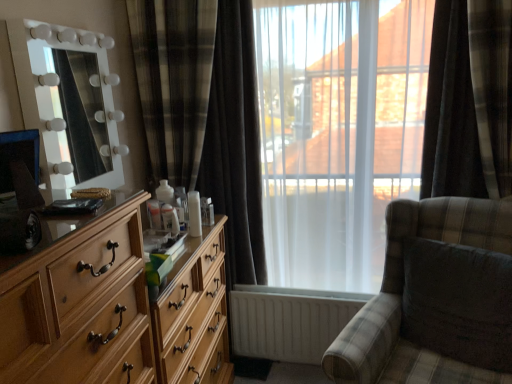
What do you see at coordinates (469, 101) in the screenshot? The height and width of the screenshot is (384, 512). I see `dark plaid curtain at right, the first curtain viewed from the right` at bounding box center [469, 101].

At what (x,y) coordinates should I click in order to perform the action: click on plaid fabric rocking chair at center. Please return your answer as a coordinate pair (x, y). Looking at the image, I should click on pyautogui.click(x=436, y=299).

The width and height of the screenshot is (512, 384). Describe the element at coordinates (338, 133) in the screenshot. I see `white sheer curtains at center` at that location.

What do you see at coordinates (205, 113) in the screenshot? The height and width of the screenshot is (384, 512). I see `plaid fabric curtain at center, positioned as the first curtain in left-to-right order` at bounding box center [205, 113].

The image size is (512, 384). Describe the element at coordinates (115, 310) in the screenshot. I see `light wood dresser at left` at that location.

Find the location of `plaid fabric swivel chair at right`. plaid fabric swivel chair at right is located at coordinates (458, 302).

Is light wood dresser at left oriented towards plaid fabric curtain at center, which is counted as the second curtain, starting from the right?

No, light wood dresser at left does not turn towards plaid fabric curtain at center, which is counted as the second curtain, starting from the right.

You are a GUI agent. You are given a task and a screenshot of the screen. Output one action in this format:
    pyautogui.click(x=<x>, y=<y>)
    Task: Click on the chest of drawers on the left of the plaid fabric curtain at center, which is counted as the second curtain, starting from the right
    This screenshot has height=384, width=512.
    Given the screenshot: What is the action you would take?
    pyautogui.click(x=115, y=310)

Is light wood dresser at left surrounding plaid fabric curtain at center, which is counted as the second curtain, starting from the right?

No, plaid fabric curtain at center, which is counted as the second curtain, starting from the right, is not inside light wood dresser at left.

Which is less distant, (430, 147) or (473, 323)?

Point (430, 147) is farther from the camera than point (473, 323).

Can plaid fabric rocking chair at center be found inside dark plaid curtain at right, which ranks as the 2th curtain in left-to-right order?

No, dark plaid curtain at right, which ranks as the 2th curtain in left-to-right order, does not contain plaid fabric rocking chair at center.

From the image's perspective, is dark plaid curtain at right, which ranks as the 2th curtain in left-to-right order, located above plaid fabric rocking chair at center?

Yes, from the image's perspective, dark plaid curtain at right, which ranks as the 2th curtain in left-to-right order, is on top of plaid fabric rocking chair at center.

Is dark plaid curtain at right, which ranks as the 2th curtain in left-to-right order, with plaid fabric rocking chair at center?

No.

Is light wood dresser at left in contact with dark plaid curtain at right, the first curtain viewed from the right?

No, light wood dresser at left is not with dark plaid curtain at right, the first curtain viewed from the right.

From a real-world perspective, does light wood dresser at left sit lower than dark plaid curtain at right, the first curtain viewed from the right?

Indeed, from a real-world perspective, light wood dresser at left is positioned beneath dark plaid curtain at right, the first curtain viewed from the right.

Where is `the 2nd curtain located above the light wood dresser at left (from a real-world perspective)`? The width and height of the screenshot is (512, 384). the 2nd curtain located above the light wood dresser at left (from a real-world perspective) is located at coordinates (469, 101).

Considering the sizes of objects light wood dresser at left and dark plaid curtain at right, which ranks as the 2th curtain in left-to-right order, in the image provided, who is smaller, light wood dresser at left or dark plaid curtain at right, which ranks as the 2th curtain in left-to-right order,?

With smaller size is dark plaid curtain at right, which ranks as the 2th curtain in left-to-right order.

Which object is positioned more to the right, plaid fabric swivel chair at right or white sheer curtains at center?

Positioned to the right is plaid fabric swivel chair at right.

Between point (496, 263) and point (326, 289), which one is positioned behind?

Point (326, 289)

From a real-world perspective, is plaid fabric swivel chair at right positioned above or below white sheer curtains at center?

plaid fabric swivel chair at right is below white sheer curtains at center.

From the image's perspective, is plaid fabric swivel chair at right positioned above or below white sheer curtains at center?

Based on their image positions, plaid fabric swivel chair at right is located beneath white sheer curtains at center.

Which of these two, white glossy mirror at left or dark plaid curtain at right, the first curtain viewed from the right, is thinner?

white glossy mirror at left.

Considering the sizes of objects white glossy mirror at left and dark plaid curtain at right, which ranks as the 2th curtain in left-to-right order, in the image provided, who is taller, white glossy mirror at left or dark plaid curtain at right, which ranks as the 2th curtain in left-to-right order,?

With more height is dark plaid curtain at right, which ranks as the 2th curtain in left-to-right order.

Is white glossy mirror at left at the left side of dark plaid curtain at right, which ranks as the 2th curtain in left-to-right order?

Yes, white glossy mirror at left is to the left of dark plaid curtain at right, which ranks as the 2th curtain in left-to-right order.

Is white glossy mirror at left far away from dark plaid curtain at right, the first curtain viewed from the right?

Absolutely, white glossy mirror at left is distant from dark plaid curtain at right, the first curtain viewed from the right.

Is white glossy mirror at left smaller than light wood dresser at left?

Yes.

Which of these two, white glossy mirror at left or light wood dresser at left, is wider?

With larger width is light wood dresser at left.

In the image, there is a white glossy mirror at left. In order to click on the chest of drawers below it (from the image's perspective) in this screenshot , I will do `click(115, 310)`.

Is white glossy mirror at left taller or shorter than light wood dresser at left?

Clearly, white glossy mirror at left is shorter compared to light wood dresser at left.

Does light wood dresser at left have a greater height compared to plaid fabric swivel chair at right?

Yes, light wood dresser at left is taller than plaid fabric swivel chair at right.

What's the angular difference between light wood dresser at left and plaid fabric swivel chair at right's facing directions?

The angle between the facing direction of light wood dresser at left and the facing direction of plaid fabric swivel chair at right is 120 degrees.

Which is more to the left, light wood dresser at left or plaid fabric swivel chair at right?

light wood dresser at left.

Are light wood dresser at left and plaid fabric swivel chair at right far apart?

Absolutely, light wood dresser at left is distant from plaid fabric swivel chair at right.

Where is `the chest of drawers in front of the plaid fabric curtain at center, which is counted as the second curtain, starting from the right`? The width and height of the screenshot is (512, 384). the chest of drawers in front of the plaid fabric curtain at center, which is counted as the second curtain, starting from the right is located at coordinates (115, 310).

Find the location of a particular element. rocking chair below the dark plaid curtain at right, the first curtain viewed from the right (from the image's perspective) is located at coordinates (436, 299).

Looking at the image, which one is located closer to plaid fabric curtain at center, which is counted as the second curtain, starting from the right, white glossy mirror at left or white plastic radiator at lower center?

Among the two, white glossy mirror at left is located nearer to plaid fabric curtain at center, which is counted as the second curtain, starting from the right.

When comparing their distances from white plastic radiator at lower center, does plaid fabric curtain at center, which is counted as the second curtain, starting from the right, or plaid fabric swivel chair at right seem further?

The object further to white plastic radiator at lower center is plaid fabric swivel chair at right.

From the image, which object appears to be nearer to white glossy mirror at left, white sheer curtains at center or plaid fabric swivel chair at right?

Based on the image, white sheer curtains at center appears to be nearer to white glossy mirror at left.

Considering their positions, is white glossy mirror at left positioned further to dark plaid curtain at right, the first curtain viewed from the right, than light wood dresser at left?

white glossy mirror at left lies further to dark plaid curtain at right, the first curtain viewed from the right, than the other object.

Estimate the real-world distances between objects in this image. Which object is further from white plastic radiator at lower center, white sheer curtains at center or plaid fabric swivel chair at right?

plaid fabric swivel chair at right is further to white plastic radiator at lower center.

Looking at the image, which one is located closer to plaid fabric swivel chair at right, white sheer curtains at center or light wood dresser at left?

white sheer curtains at center is positioned closer to the anchor plaid fabric swivel chair at right.

From the image, which object appears to be farther from white plastic radiator at lower center, white glossy mirror at left or plaid fabric curtain at center, positioned as the first curtain in left-to-right order?

white glossy mirror at left.

Estimate the real-world distances between objects in this image. Which object is closer to white plastic radiator at lower center, plaid fabric swivel chair at right or white glossy mirror at left?

plaid fabric swivel chair at right is positioned closer to the anchor white plastic radiator at lower center.

Where is `swivel chair between plaid fabric curtain at center, positioned as the first curtain in left-to-right order, and dark plaid curtain at right, the first curtain viewed from the right, in the horizontal direction`? swivel chair between plaid fabric curtain at center, positioned as the first curtain in left-to-right order, and dark plaid curtain at right, the first curtain viewed from the right, in the horizontal direction is located at coordinates (458, 302).

Find the location of a particular element. This screenshot has width=512, height=384. radiator between plaid fabric curtain at center, positioned as the first curtain in left-to-right order, and dark plaid curtain at right, the first curtain viewed from the right, from left to right is located at coordinates (289, 321).

The height and width of the screenshot is (384, 512). I want to click on rocking chair between dark plaid curtain at right, which ranks as the 2th curtain in left-to-right order, and white plastic radiator at lower center, in the vertical direction, so click(x=436, y=299).

Locate an element on the screen. bay window between white glossy mirror at left and plaid fabric rocking chair at center in the horizontal direction is located at coordinates (338, 133).